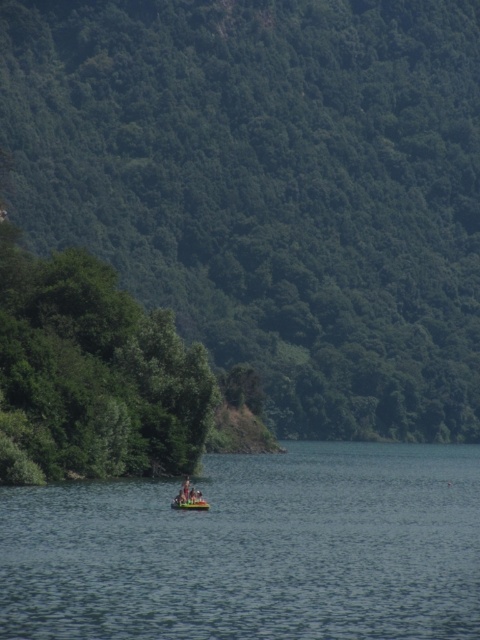
You are standing at point [188,506] and want to walk to the lake. Is point [167,124] between you and the lake?

Point [167,124] is behind point [188,506], so it is not between you and the lake. The lake is in front of you.